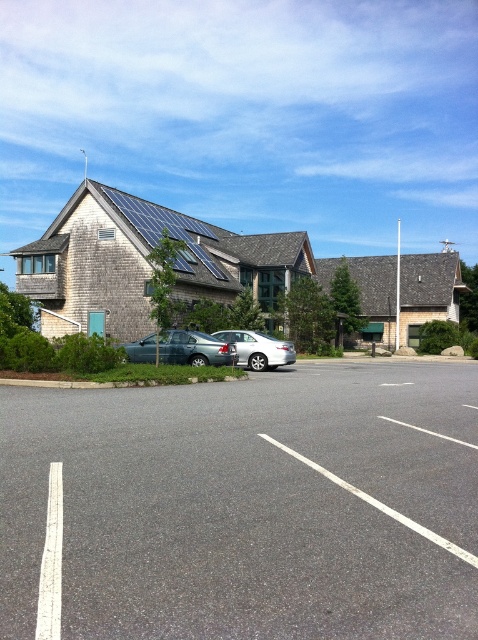
Can you confirm if white painted line at lower left is taller than satin silver sedan at center?

No.

Does white painted line at lower left appear under satin silver sedan at center?

Indeed, white painted line at lower left is positioned under satin silver sedan at center.

Between point (60, 497) and point (210, 352), which one is positioned behind?

Positioned behind is point (210, 352).

You are a GUI agent. You are given a task and a screenshot of the screen. Output one action in this format:
    pyautogui.click(x=<x>, y=<y>)
    Task: Click on the white painted line at lower left
    Image resolution: width=478 pixels, height=640 pixels.
    Given the screenshot: What is the action you would take?
    pyautogui.click(x=51, y=561)

Is point (184, 340) farther from camera compared to point (257, 333)?

No.

Who is more forward, (160, 346) or (260, 365)?

Point (160, 346) is more forward.

The image size is (478, 640). What are the coordinates of `satin silver sedan at center` in the screenshot? It's located at (193, 348).

Is point (456, 417) positioned before point (51, 548)?

No, (456, 417) is further to viewer.

Looking at this image, is gray asphalt parking lot at center to the left of white painted line at lower left from the viewer's perspective?

Incorrect, gray asphalt parking lot at center is not on the left side of white painted line at lower left.

Is point (226, 413) closer to viewer compared to point (54, 490)?

That is False.

The image size is (478, 640). I want to click on gray asphalt parking lot at center, so click(x=249, y=506).